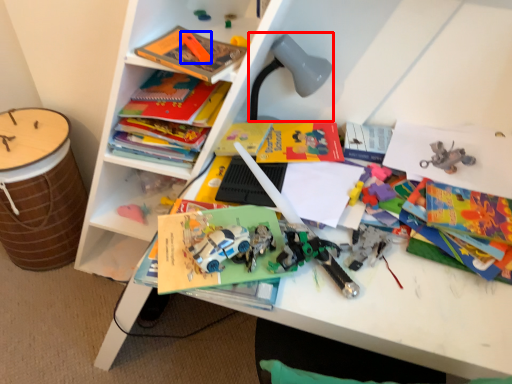
Question: Which object is further to the camera taking this photo, lamp (highlighted by a red box) or toy (highlighted by a blue box)?

Choices:
 (A) lamp
 (B) toy

Answer: (A)